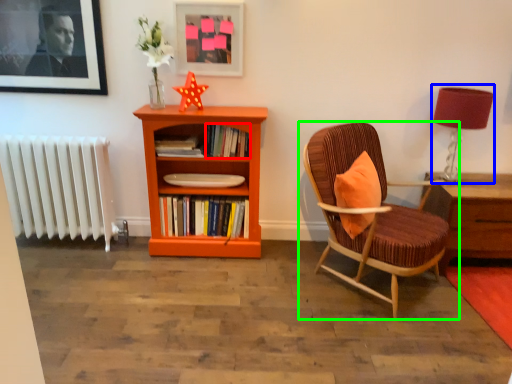
Question: Considering the real-world distances, which object is closest to book (highlighted by a red box)? table lamp (highlighted by a blue box) or chair (highlighted by a green box).

Choices:
 (A) table lamp
 (B) chair

Answer: (B)